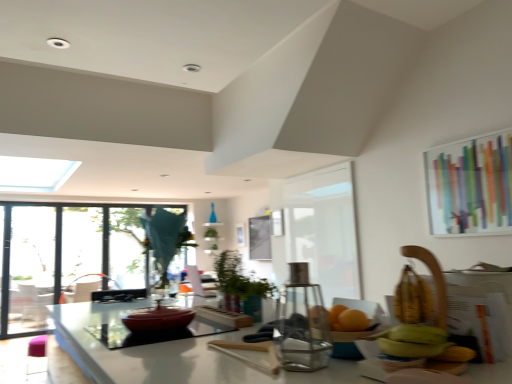
Question: Is clear glass screen door at left, which is the 2th screen door from right to left, positioned behind transparent glass window at left?

Choices:
 (A) yes
 (B) no

Answer: (A)

Question: Is clear glass screen door at left, the second screen door when ordered from front to back, oriented away from transparent glass window at left?

Choices:
 (A) no
 (B) yes

Answer: (B)

Question: Is clear glass screen door at left, which is the first screen door from back to front, closer to camera compared to transparent glass window at left?

Choices:
 (A) no
 (B) yes

Answer: (A)

Question: Does clear glass screen door at left, which is the first screen door from back to front, have a smaller size compared to transparent glass window at left?

Choices:
 (A) no
 (B) yes

Answer: (B)

Question: Does clear glass screen door at left, the second screen door when ordered from front to back, appear on the right side of transparent glass window at left?

Choices:
 (A) no
 (B) yes

Answer: (A)

Question: Is point (94, 218) positioned closer to the camera than point (99, 329)?

Choices:
 (A) closer
 (B) farther

Answer: (B)

Question: In terms of width, does transparent glass window at left look wider or thinner when compared to transparent glass table at center?

Choices:
 (A) wide
 (B) thin

Answer: (B)

Question: Based on their sizes in the image, would you say transparent glass window at left is bigger or smaller than transparent glass table at center?

Choices:
 (A) small
 (B) big

Answer: (B)

Question: Is transparent glass window at left in front of or behind transparent glass table at center in the image?

Choices:
 (A) front
 (B) behind

Answer: (B)

Question: Is point (237, 301) positioned closer to the camera than point (138, 208)?

Choices:
 (A) farther
 (B) closer

Answer: (B)

Question: Is green matte plant at center bigger or smaller than transparent glass window at left?

Choices:
 (A) big
 (B) small

Answer: (B)

Question: From a real-world perspective, is green matte plant at center physically located above or below transparent glass window at left?

Choices:
 (A) below
 (B) above

Answer: (B)

Question: Is green matte plant at center wider or thinner than transparent glass window at left?

Choices:
 (A) thin
 (B) wide

Answer: (B)

Question: Is colorful glass window screen at upper right taller or shorter than white matte screen door at center, placed as the second screen door when sorted from left to right?

Choices:
 (A) short
 (B) tall

Answer: (A)

Question: From a real-world perspective, is colorful glass window screen at upper right physically located above or below white matte screen door at center, which is counted as the second screen door, starting from the back?

Choices:
 (A) above
 (B) below

Answer: (A)